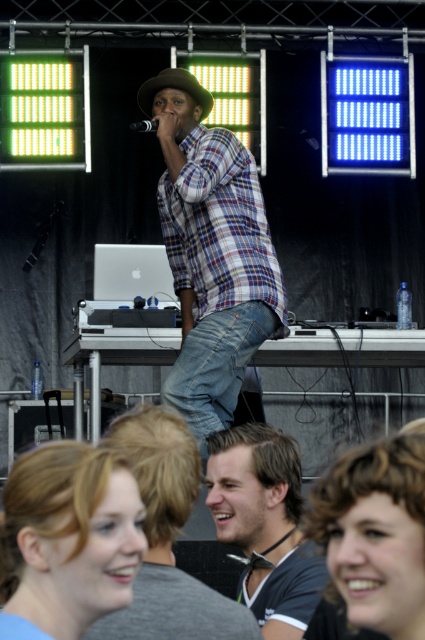
Question: Among these points, which one is farthest from the camera?

Choices:
 (A) (192, 76)
 (B) (280, 584)
 (C) (277, 280)
 (D) (166, 380)

Answer: (A)

Question: Which point is farther to the camera?

Choices:
 (A) (149, 104)
 (B) (218, 515)

Answer: (A)

Question: Which of these objects is positioned closest to the plaid cotton shirt at center?

Choices:
 (A) dark brown hair at center
 (B) brown felt fedora at center
 (C) black plastic microphone at upper center

Answer: (C)

Question: Is blonde hair at lower left closer to camera compared to blonde hair at lower right?

Choices:
 (A) no
 (B) yes

Answer: (A)

Question: Does blonde hair at lower left have a greater width compared to black plastic microphone at upper center?

Choices:
 (A) yes
 (B) no

Answer: (A)

Question: Can you confirm if plaid cotton shirt at center is positioned below blonde hair at lower left?

Choices:
 (A) yes
 (B) no

Answer: (B)